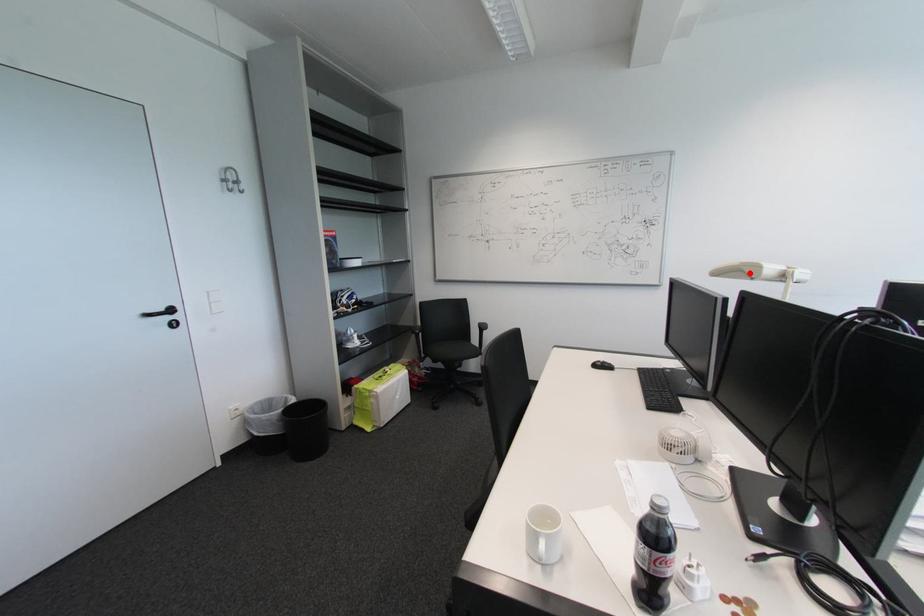
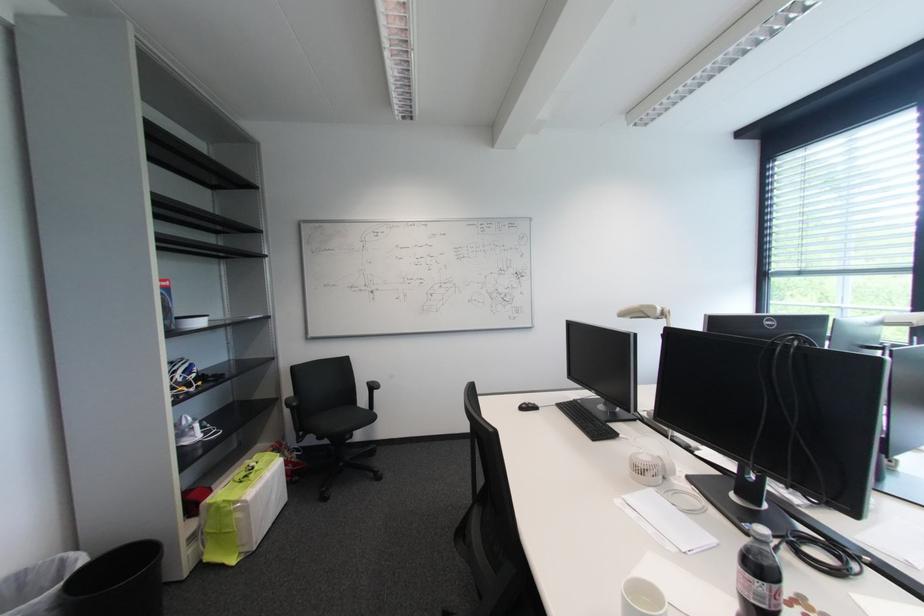
Where in the second image is the point corresponding to the highlighted location from the first image?

(649, 314)